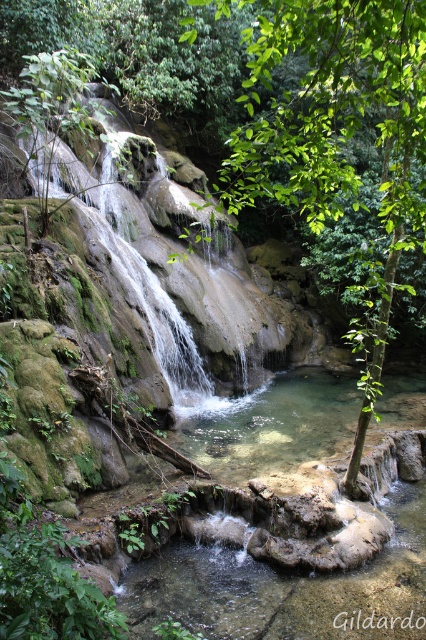
Does green leafy tree at center appear under green mossy rock at center?

Yes, green leafy tree at center is below green mossy rock at center.

Between point (347, 28) and point (137, 225), which one is positioned in front?

Positioned in front is point (347, 28).

Image resolution: width=426 pixels, height=640 pixels. Find the location of `green leafy tree at center`. green leafy tree at center is located at coordinates (336, 134).